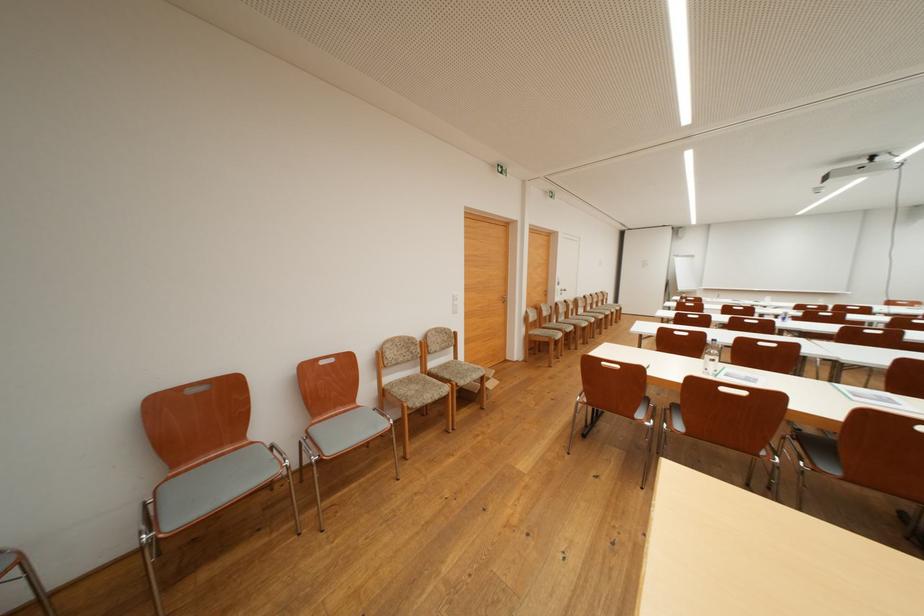
Find where to press the white light switch. Please return your answer as a coordinate pair (x, y).

(455, 302)